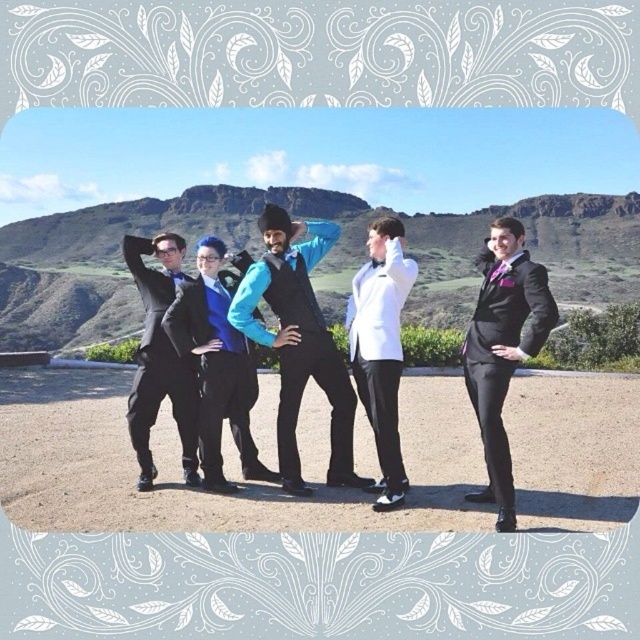
Does white satin tuxedo at center appear over matte black suit at left?

Actually, white satin tuxedo at center is below matte black suit at left.

Can you confirm if white satin tuxedo at center is positioned to the right of matte black suit at left?

Correct, you'll find white satin tuxedo at center to the right of matte black suit at left.

Find the location of a particular element. This screenshot has height=640, width=640. white satin tuxedo at center is located at coordinates (380, 348).

Does shiny black suit at right come behind white satin tuxedo at center?

No, shiny black suit at right is closer to the viewer.

Is shiny black suit at right shorter than white satin tuxedo at center?

In fact, shiny black suit at right may be taller than white satin tuxedo at center.

Find the location of a particular element. Image resolution: width=640 pixels, height=640 pixels. shiny black suit at right is located at coordinates (502, 349).

Between matte blue vest at center and matte black suit at left, which one is positioned lower?

matte black suit at left is below.

Is matte blue vest at center smaller than matte black suit at left?

No, matte blue vest at center is not smaller than matte black suit at left.

Between point (291, 282) and point (188, 417), which one is positioned behind?

The point (291, 282) is more distant.

At what (x,y) coordinates should I click in order to perform the action: click on matte blue vest at center. Please return your answer as a coordinate pair (x, y). The height and width of the screenshot is (640, 640). Looking at the image, I should click on (298, 342).